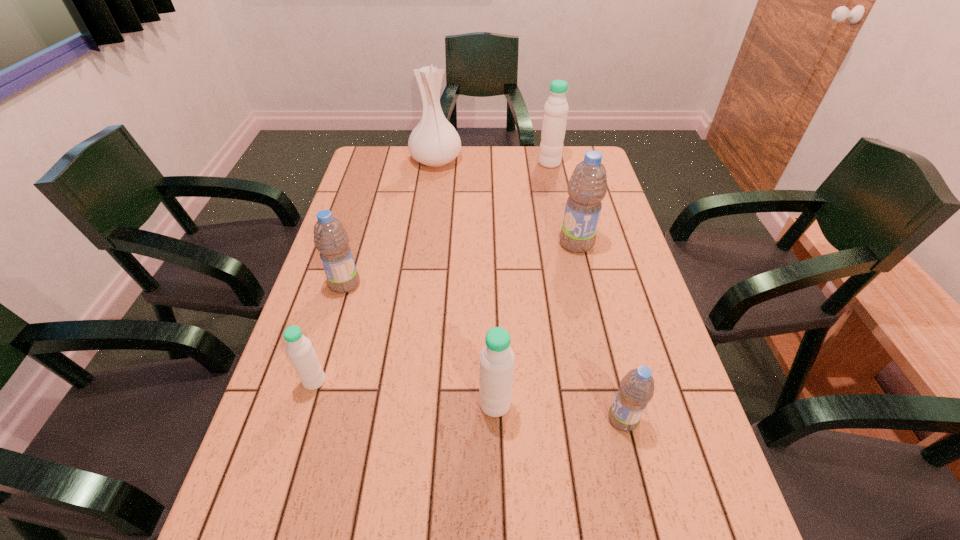
In order to click on water bottle that is at the far edge in this screenshot , I will do `click(554, 122)`.

Where is `object that is at the far right corner`? The image size is (960, 540). object that is at the far right corner is located at coordinates (554, 122).

At what (x,y) coordinates should I click in order to perform the action: click on vacant region at the far edge of the desktop. Please return your answer as a coordinate pair (x, y). The width and height of the screenshot is (960, 540). Looking at the image, I should click on (494, 169).

This screenshot has width=960, height=540. In order to click on vacant space at the left edge of the desktop in this screenshot , I will do `click(344, 297)`.

Where is `free space at the right edge of the desktop`? The height and width of the screenshot is (540, 960). free space at the right edge of the desktop is located at coordinates (624, 308).

Find the location of a particular element. The height and width of the screenshot is (540, 960). vacant area that lies between the second smallest white water bottle and the biggest blue water bottle is located at coordinates coord(536,324).

I want to click on free spot between the second biggest white water bottle and the smallest blue water bottle, so 559,411.

The width and height of the screenshot is (960, 540). Find the location of `vacant space that's between the third farthest object and the second smallest blue water bottle`. vacant space that's between the third farthest object and the second smallest blue water bottle is located at coordinates (461, 264).

Locate an element on the screen. vacant area between the smallest blue water bottle and the smallest white water bottle is located at coordinates (468, 400).

At what (x,y) coordinates should I click in order to perform the action: click on free spot between the rightmost white water bottle and the nearest blue water bottle. Please return your answer as a coordinate pair (x, y). The image size is (960, 540). Looking at the image, I should click on (587, 291).